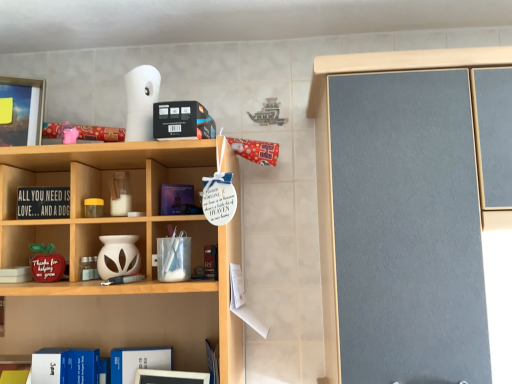
Question: Which direction should I rotate to look at clear glass jar at center, placed as the 1th cabinet when sorted from top to bottom, — up or down?

Choices:
 (A) up
 (B) down

Answer: (B)

Question: From a real-world perspective, does black wood sign at left, positioned as the first book in left-to-right order, stand above clear glass jar at center, which appears as the 2th cabinet when ordered from the bottom?

Choices:
 (A) yes
 (B) no

Answer: (B)

Question: From a real-world perspective, is black wood sign at left, acting as the first book starting from the top, physically below clear glass jar at center, placed as the 1th cabinet when sorted from top to bottom?

Choices:
 (A) yes
 (B) no

Answer: (A)

Question: Is black wood sign at left, positioned as the first book in left-to-right order, oriented away from clear glass jar at center, which appears as the 2th cabinet when ordered from the bottom?

Choices:
 (A) yes
 (B) no

Answer: (B)

Question: Considering the relative positions of black wood sign at left, which is counted as the 2th book, starting from the right, and clear glass jar at center, placed as the 1th cabinet when sorted from top to bottom, in the image provided, is black wood sign at left, which is counted as the 2th book, starting from the right, to the right of clear glass jar at center, placed as the 1th cabinet when sorted from top to bottom, from the viewer's perspective?

Choices:
 (A) no
 (B) yes

Answer: (A)

Question: Considering the relative sizes of black wood sign at left, the 2th book in the bottom-to-top sequence, and clear glass jar at center, placed as the 1th cabinet when sorted from top to bottom, in the image provided, is black wood sign at left, the 2th book in the bottom-to-top sequence, smaller than clear glass jar at center, placed as the 1th cabinet when sorted from top to bottom,?

Choices:
 (A) yes
 (B) no

Answer: (A)

Question: From the image's perspective, does black wood sign at left, which is counted as the 2th book, starting from the right, appear higher than clear glass jar at center, placed as the 1th cabinet when sorted from top to bottom?

Choices:
 (A) yes
 (B) no

Answer: (B)

Question: Does blue hardcover book at lower left, acting as the first book starting from the bottom, have a smaller size compared to black wood sign at left, acting as the first book starting from the top?

Choices:
 (A) no
 (B) yes

Answer: (A)

Question: Is blue hardcover book at lower left, acting as the second book starting from the top, at the left side of black wood sign at left, the 2th book in the bottom-to-top sequence?

Choices:
 (A) yes
 (B) no

Answer: (B)

Question: Could black wood sign at left, acting as the first book starting from the top, be considered to be inside blue hardcover book at lower left, acting as the first book starting from the bottom?

Choices:
 (A) no
 (B) yes

Answer: (A)

Question: Is blue hardcover book at lower left, which ranks as the 2th book in left-to-right order, turned away from black wood sign at left, positioned as the first book in left-to-right order?

Choices:
 (A) no
 (B) yes

Answer: (A)

Question: Does blue hardcover book at lower left, acting as the second book starting from the top, have a greater height compared to black wood sign at left, the 2th book in the bottom-to-top sequence?

Choices:
 (A) no
 (B) yes

Answer: (B)

Question: From the image's perspective, is blue hardcover book at lower left, acting as the first book starting from the bottom, under black wood sign at left, acting as the first book starting from the top?

Choices:
 (A) no
 (B) yes

Answer: (B)

Question: Could you tell me if blue hardcover book at lower left, acting as the second book starting from the top, is facing white matte vase at center, marked as the 2th cabinet in a top-to-bottom arrangement?

Choices:
 (A) no
 (B) yes

Answer: (A)